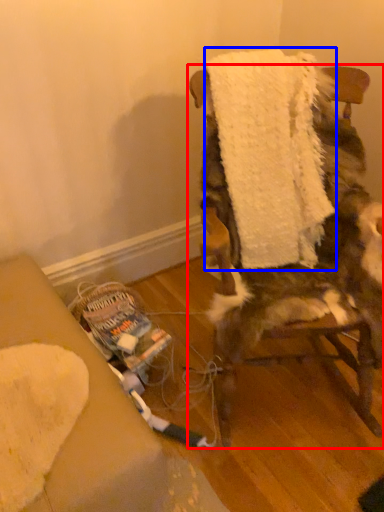
Question: Which object appears farthest to the camera in this image, chair (highlighted by a red box) or bath towel (highlighted by a blue box)?

Choices:
 (A) chair
 (B) bath towel

Answer: (B)